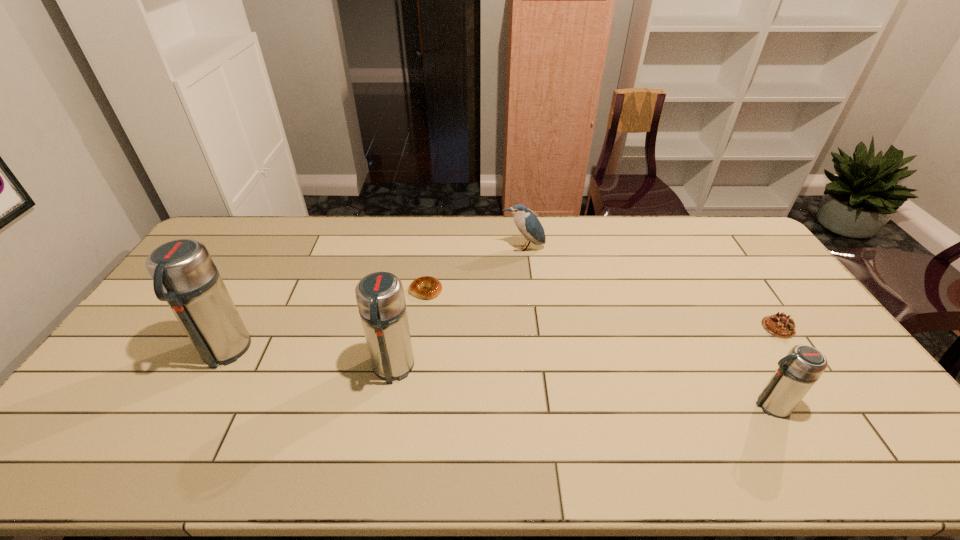
Where is `vacant space that is in between the rightmost thermos bottle and the second shortest object`? vacant space that is in between the rightmost thermos bottle and the second shortest object is located at coordinates (775, 366).

Find the location of `empty location between the leftmost object and the bagel`. empty location between the leftmost object and the bagel is located at coordinates (324, 321).

Locate an element on the screen. free space between the second thermos bottle from left to right and the fifth object from left to right is located at coordinates (582, 387).

Where is `vacant area that lies between the nearest thermos bottle and the second thermos bottle from left to right`? This screenshot has width=960, height=540. vacant area that lies between the nearest thermos bottle and the second thermos bottle from left to right is located at coordinates (582, 387).

Locate an element on the screen. blank region between the leftmost thermos bottle and the nearest thermos bottle is located at coordinates (497, 379).

Find the location of a particular element. This screenshot has width=960, height=540. empty space that is in between the bird and the shortest object is located at coordinates (474, 269).

Identify the location of free space between the chocolate cake and the bird. Image resolution: width=960 pixels, height=540 pixels. (651, 288).

Identify which object is the fifth closest to the second thermos bottle from right to left. Please provide its 2D coordinates. Your answer should be formatted as a tuple, i.e. [(x, y)], where the tuple contains the x and y coordinates of a point satisfying the conditions above.

[(779, 325)]

Locate an element on the screen. The height and width of the screenshot is (540, 960). the third closest object to the chocolate cake is located at coordinates (433, 287).

Locate which thermos bottle ranks second in proximity to the shortest object. Please provide its 2D coordinates. Your answer should be formatted as a tuple, i.e. [(x, y)], where the tuple contains the x and y coordinates of a point satisfying the conditions above.

[(184, 275)]